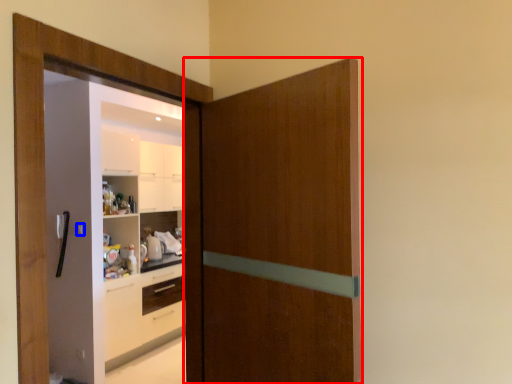
Question: Which object appears farthest to the camera in this image, door (highlighted by a red box) or door handle (highlighted by a blue box)?

Choices:
 (A) door
 (B) door handle

Answer: (B)